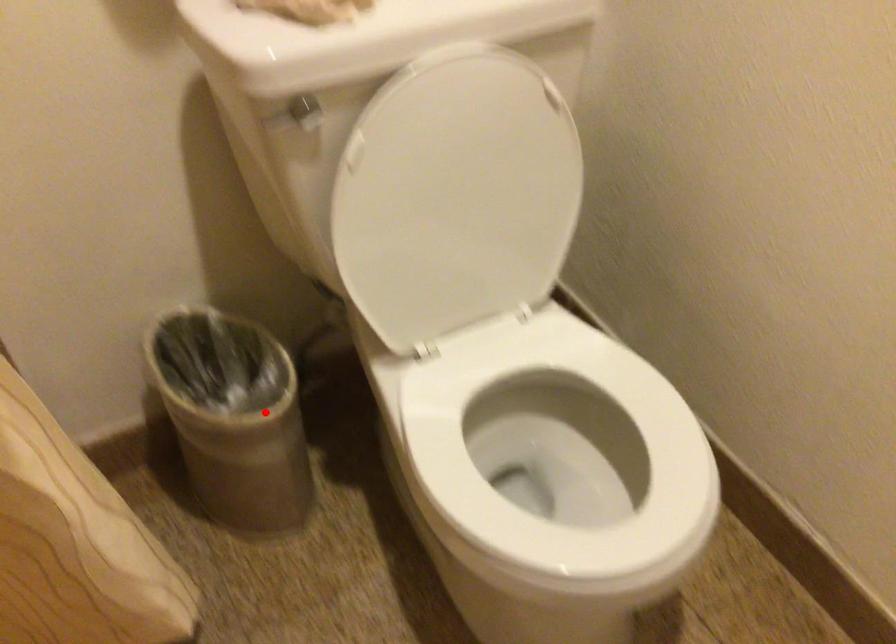
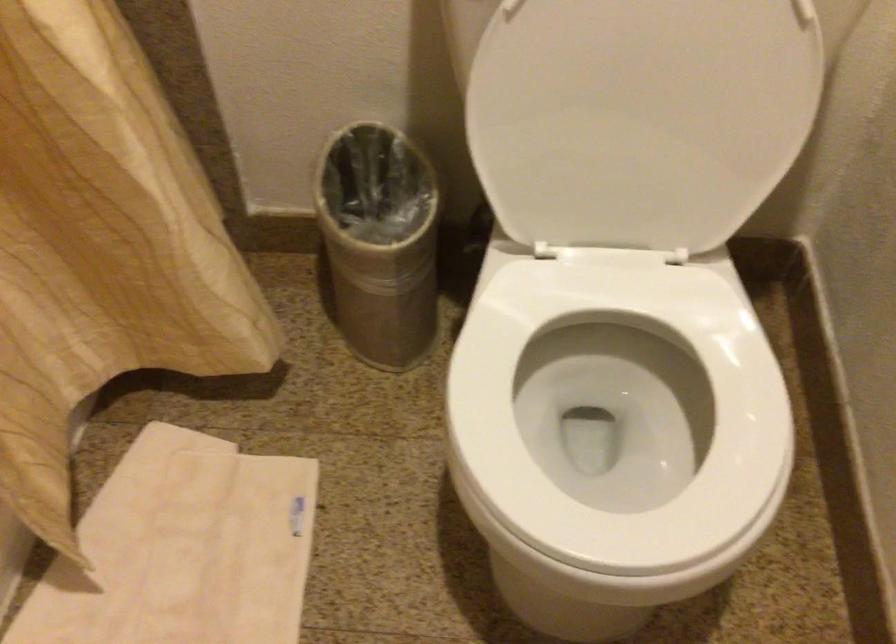
Locate, in the second image, the point that corresponds to the highlighted location in the first image.

(380, 242)